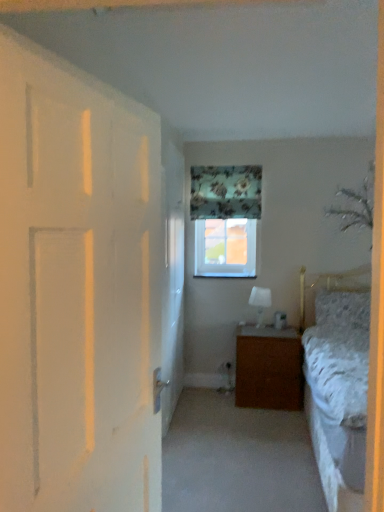
Locate an element on the screen. This screenshot has height=512, width=384. vacant area that lies in front of white glossy lampshade at center is located at coordinates (257, 328).